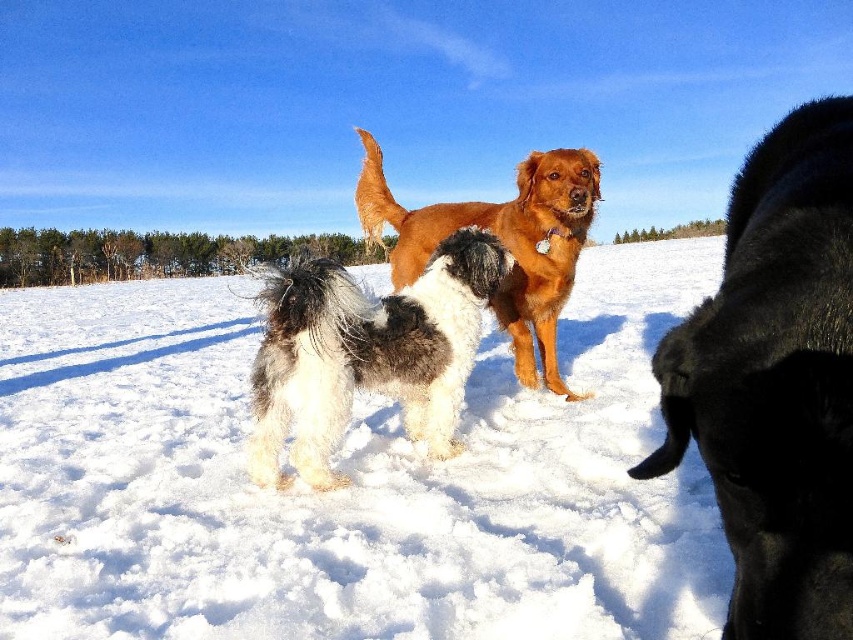
Looking at this image, can you confirm if black fur dog at right is positioned to the right of golden brown fur at center?

Yes, black fur dog at right is to the right of golden brown fur at center.

Based on the photo, measure the distance from black fur dog at right to golden brown fur at center.

They are 3.93 meters apart.

Identify the location of black fur dog at right. (776, 381).

Where is `black fur dog at right`? black fur dog at right is located at coordinates (776, 381).

Between white fluffy snow at center and black fur dog at right, which one appears on the left side from the viewer's perspective?

white fluffy snow at center

How much distance is there between white fluffy snow at center and black fur dog at right?

white fluffy snow at center and black fur dog at right are 10.22 meters apart.

The width and height of the screenshot is (853, 640). Describe the element at coordinates (352, 481) in the screenshot. I see `white fluffy snow at center` at that location.

Locate an element on the screen. This screenshot has width=853, height=640. white fluffy snow at center is located at coordinates (352, 481).

In the scene shown: Who is shorter, black fur dog at right or fluffy white and black dog at center?

black fur dog at right is shorter.

At what (x,y) coordinates should I click in order to perform the action: click on black fur dog at right. Please return your answer as a coordinate pair (x, y). The width and height of the screenshot is (853, 640). Looking at the image, I should click on (776, 381).